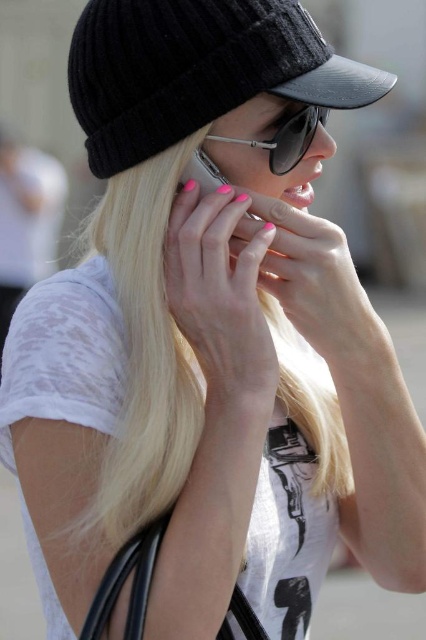
You are trying to determine the spatial relationship between the black knitted baseball hat at upper left and the sunglasses at center in the image. Which object is positioned closer to you?

The black knitted baseball hat at upper left is closer to the viewer than the sunglasses at center.

You are a fashion designer analyzing the image. Which object is bigger between the black knitted baseball hat at upper left and the sunglasses at center?

The black knitted baseball hat at upper left is larger in size than the sunglasses at center.

You are a photographer trying to capture a clear shot of the sunglasses at center without the black knitted baseball hat at upper left blocking it. Based on their positions, is this possible?

The black knitted baseball hat at upper left is positioned over the sunglasses at center, so it would block the view of the sunglasses. To capture a clear shot of the sunglasses at center, you would need to adjust your angle or have the subject move so that the hat is no longer covering them.